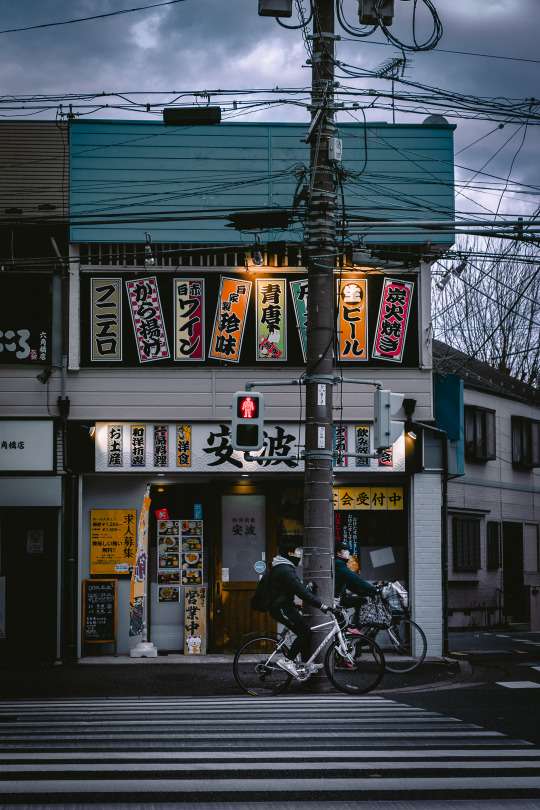
Where is `wooden door  brown color`? The height and width of the screenshot is (810, 540). wooden door  brown color is located at coordinates pyautogui.click(x=240, y=608).